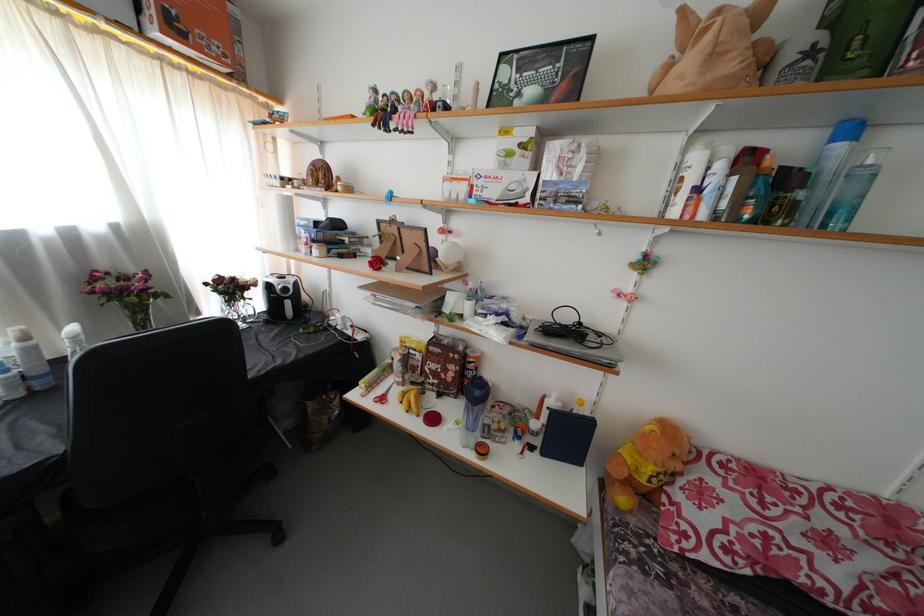
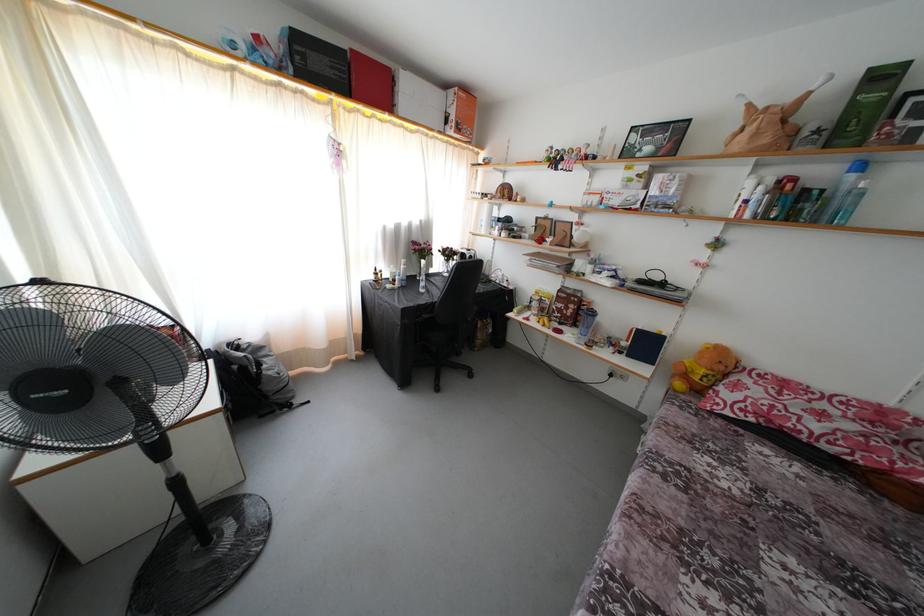
The point at (684,472) is marked in the first image. Where is the corresponding point in the second image?

(726, 373)